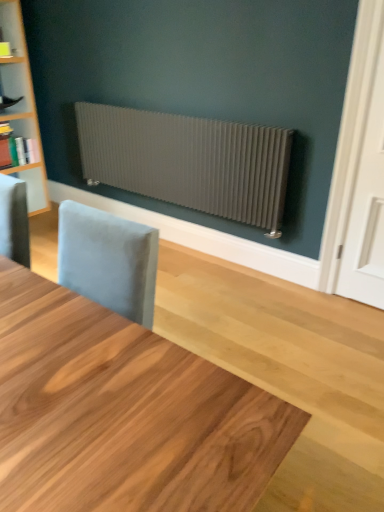
Find the location of a particular element. This screenshot has height=512, width=384. vacant location below satin silver radiator at upper center (from a real-world perspective) is located at coordinates (202, 256).